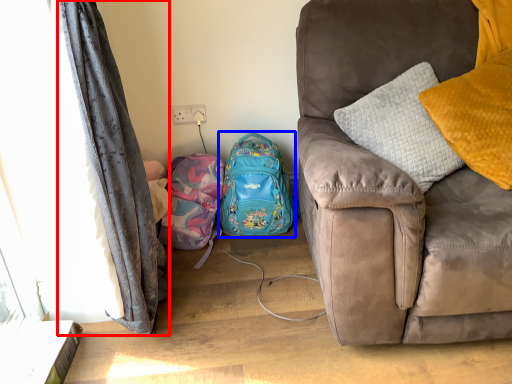
Question: Which of the following is the farthest to the observer, curtain (highlighted by a red box) or backpack (highlighted by a blue box)?

Choices:
 (A) curtain
 (B) backpack

Answer: (B)